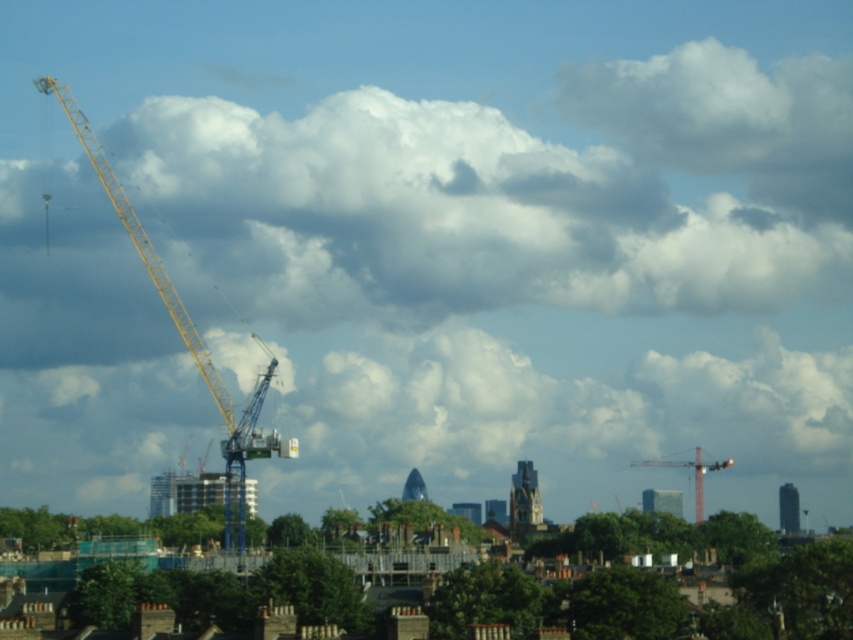
Does blue metallic crane at left lie behind yellow metallic crane at left?

No, blue metallic crane at left is closer to the viewer.

Can you confirm if blue metallic crane at left is positioned to the right of yellow metallic crane at left?

Correct, you'll find blue metallic crane at left to the right of yellow metallic crane at left.

Where is `blue metallic crane at left`? blue metallic crane at left is located at coordinates (746, 570).

Who is lower down, yellow metallic crane at left or metallic yellow crane at center?

metallic yellow crane at center is lower down.

Identify the location of yellow metallic crane at left. This screenshot has width=853, height=640. (186, 336).

Can you confirm if blue metallic crane at left is thinner than metallic yellow crane at center?

In fact, blue metallic crane at left might be wider than metallic yellow crane at center.

Can you confirm if blue metallic crane at left is positioned above metallic yellow crane at center?

Yes, blue metallic crane at left is above metallic yellow crane at center.

Is point (766, 593) closer to camera compared to point (639, 460)?

Yes, point (766, 593) is in front of point (639, 460).

Locate an element on the screen. blue metallic crane at left is located at coordinates (746, 570).